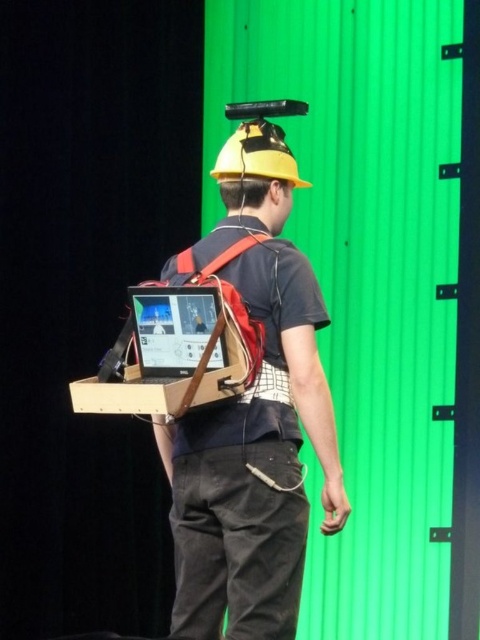
You are a technician standing 10 feet away from a person wearing a red backpack with a matte black laptop at back. You need to adjust the laptop screen. Can you reach it without moving closer?

The distance between the matte black laptop at back and the viewer is 9.59 feet, which is slightly less than 10 feet. Since you are standing exactly 10 feet away, you might be just out of reach. It is recommended to move a little closer to adjust the laptop screen comfortably.

You are setting up a camera to film the person wearing the yellow hard hat and red backpack. The matte black laptop at back is part of the scene. Where should you position the camera to ensure the laptop is centered in the frame?

The matte black laptop at back is positioned at coordinates point (171, 326), so to center it in the frame, the camera should be aligned to focus on those coordinates.

You are an event coordinator setting up for a presentation. You need to adjust the lighting so that the matte black laptop at back and yellow matte hardhat at center are both well illuminated. Based on their positions, which object should you adjust the light towards first?

The yellow matte hardhat at center should be lit first because the matte black laptop at back is to the left of it, so adjusting the light towards the center will also cover the laptop to its left.